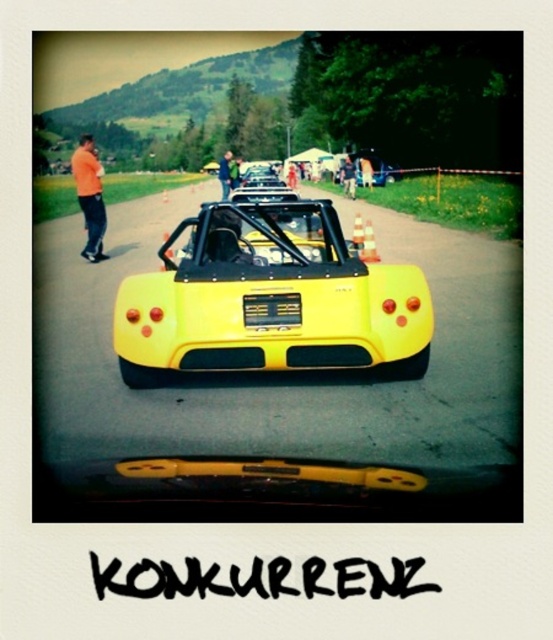
You are standing at the starting line of the race and see the orange cotton shirt at left. Which direction should you look to find the shirt?

The orange cotton shirt at left is located at point (90, 196), so you should look to your left to find the shirt.